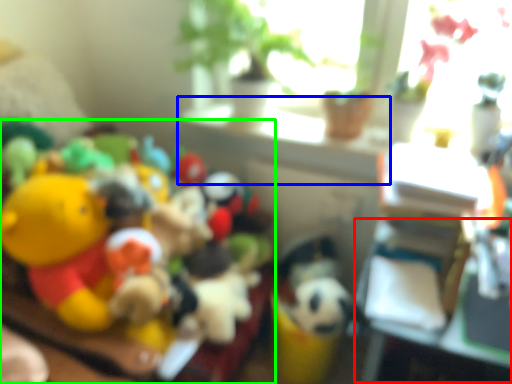
Question: Considering the real-world distances, which object is farthest from table (highlighted by a red box)? window sill (highlighted by a blue box) or toy (highlighted by a green box)?

Choices:
 (A) window sill
 (B) toy

Answer: (B)